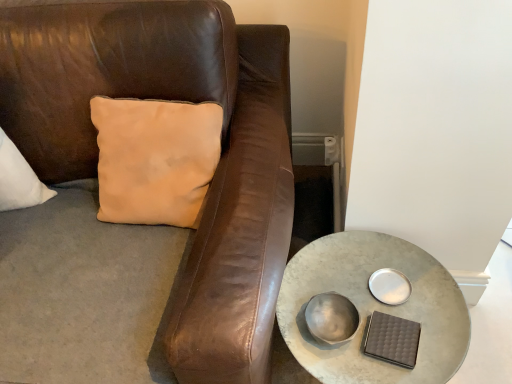
The width and height of the screenshot is (512, 384). Identify the location of free space in front of metallic silver bowl at lower center. (350, 364).